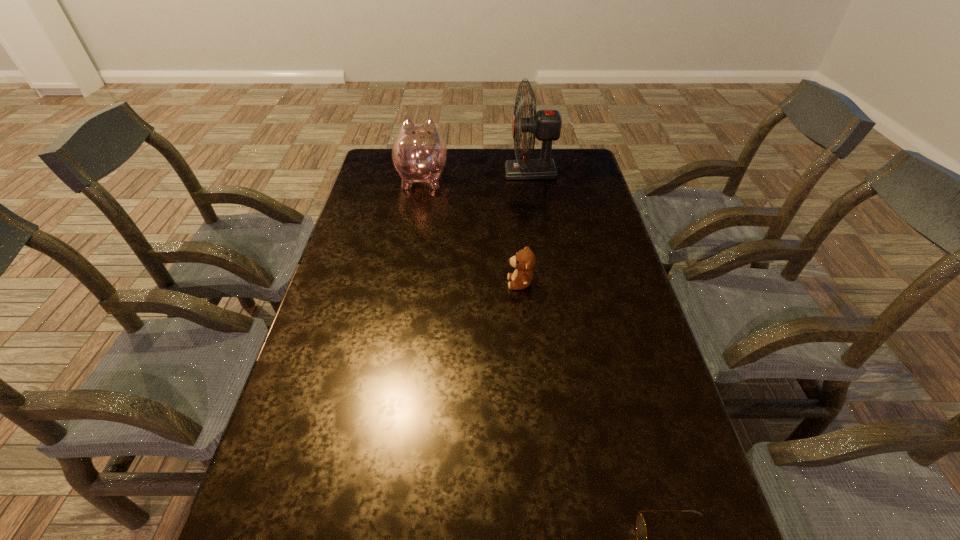
Where is `fan`? fan is located at coordinates (545, 125).

In order to click on the leftmost object in this screenshot , I will do `click(419, 154)`.

This screenshot has height=540, width=960. What are the coordinates of `piggy bank` in the screenshot? It's located at (419, 154).

You are a GUI agent. You are given a task and a screenshot of the screen. Output one action in this format:
    pyautogui.click(x=<x>, y=<y>)
    Task: Click on the third farthest object
    The width and height of the screenshot is (960, 540).
    Given the screenshot: What is the action you would take?
    pyautogui.click(x=524, y=260)

Locate an element on the screen. teddy bear is located at coordinates (524, 260).

This screenshot has height=540, width=960. I want to click on vacant area situated on the front-facing side of the tallest object, so click(418, 173).

Find the location of `vacant position located on the front-facing side of the tallest object`. vacant position located on the front-facing side of the tallest object is located at coordinates click(445, 173).

Where is `free location located 0.090m on the front-facing side of the tallest object`? The width and height of the screenshot is (960, 540). free location located 0.090m on the front-facing side of the tallest object is located at coordinates (482, 173).

Locate an element on the screen. The height and width of the screenshot is (540, 960). vacant space situated on the front facing side of the leftmost object is located at coordinates (426, 152).

Where is `free space located on the face of the teddy bear`? The height and width of the screenshot is (540, 960). free space located on the face of the teddy bear is located at coordinates (427, 283).